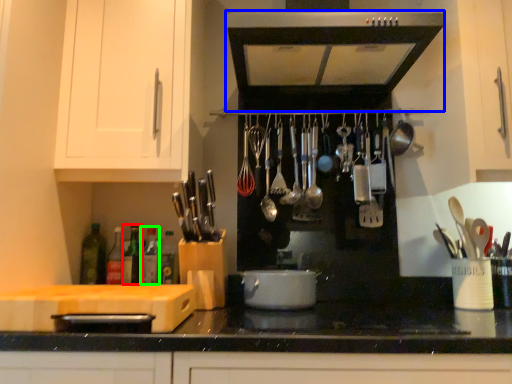
Question: Based on their relative distances, which object is farther from bottle (highlighted by a red box)? Choose from home appliance (highlighted by a blue box) and bottle (highlighted by a green box).

Choices:
 (A) home appliance
 (B) bottle

Answer: (A)